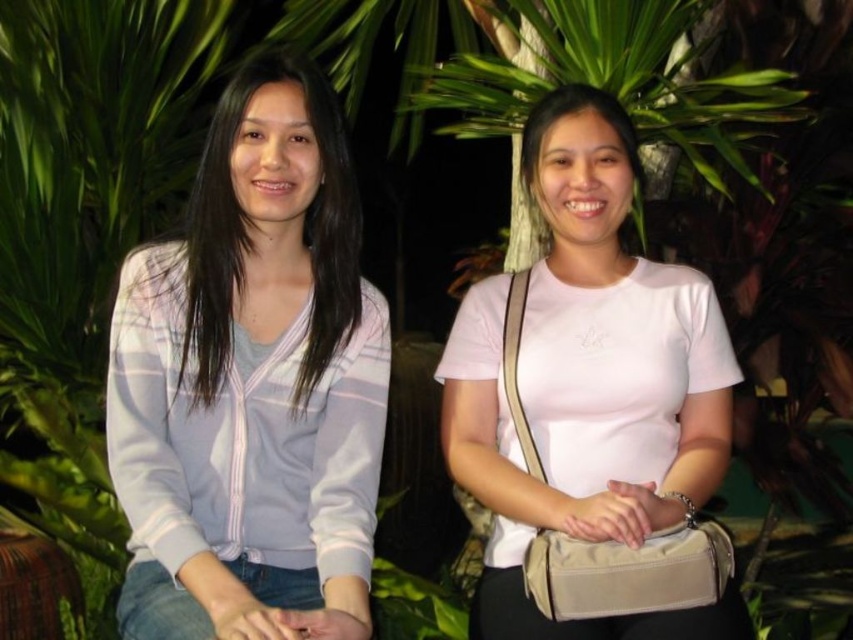
Is light purple striped cardigan at left wider than white matte shirt at center?

Yes.

Can you confirm if light purple striped cardigan at left is bigger than white matte shirt at center?

Correct, light purple striped cardigan at left is larger in size than white matte shirt at center.

Who is more distant from viewer, (248, 554) or (637, 220)?

The point (637, 220) is behind.

Identify the location of light purple striped cardigan at left. The image size is (853, 640). (252, 384).

Is light purple striped cardigan at left smaller than pink matte shirt at center?

Indeed, light purple striped cardigan at left has a smaller size compared to pink matte shirt at center.

Which is more to the left, light purple striped cardigan at left or pink matte shirt at center?

Positioned to the left is light purple striped cardigan at left.

Between point (165, 560) and point (618, 157), which one is positioned in front?

Point (165, 560) is more forward.

Locate an element on the screen. light purple striped cardigan at left is located at coordinates (252, 384).

Does pink matte shirt at center have a larger size compared to white matte shirt at center?

Yes.

The image size is (853, 640). Identify the location of pink matte shirt at center. [x=589, y=384].